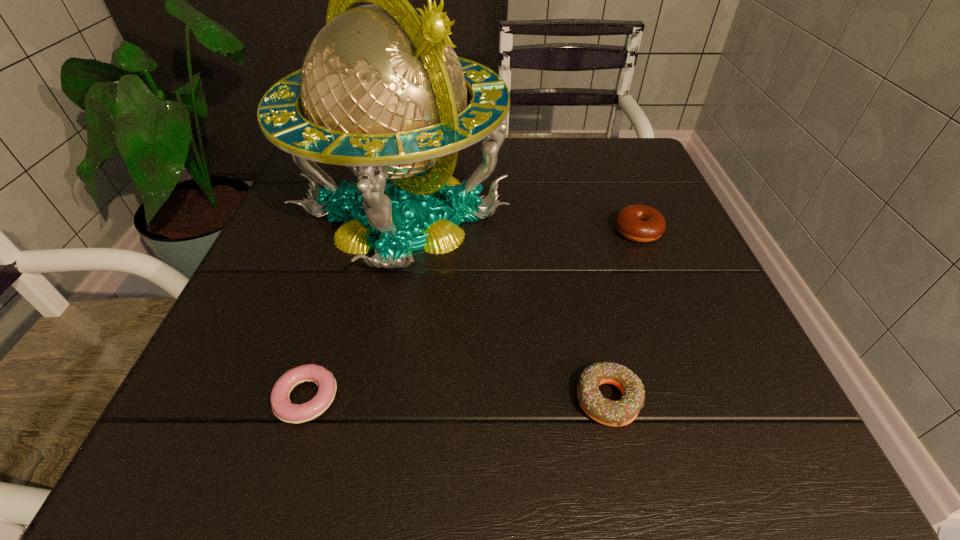
Find the location of a particular element. This screenshot has height=540, width=960. the tallest object is located at coordinates [x=384, y=94].

Where is `the farthest doughnut`? the farthest doughnut is located at coordinates (640, 223).

Find the location of `the rightmost doughnut`. the rightmost doughnut is located at coordinates (640, 223).

Where is `the third tallest object`? This screenshot has height=540, width=960. the third tallest object is located at coordinates (621, 412).

In order to click on the third object from left to right in this screenshot , I will do 621,412.

Identify the location of the shortest doughnut. The image size is (960, 540). (281, 405).

The width and height of the screenshot is (960, 540). I want to click on the shortest object, so click(281, 405).

Find the location of a particular element. free spot located 0.300m on the right of the globe is located at coordinates (652, 214).

Where is `free spot located 0.170m on the left of the rightmost object`? free spot located 0.170m on the left of the rightmost object is located at coordinates (528, 231).

Where is `vacant region located on the left of the second doughnut from right to left`? This screenshot has width=960, height=540. vacant region located on the left of the second doughnut from right to left is located at coordinates (432, 400).